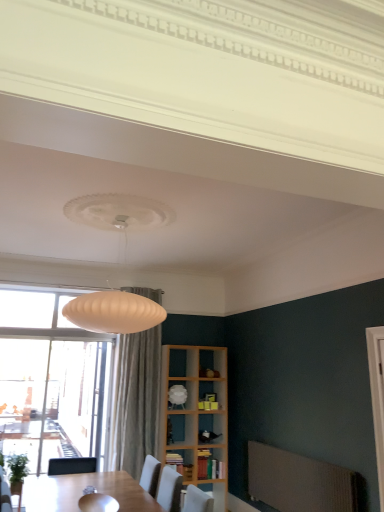
What is the approximate width of wooden bookshelf at center?

The width of wooden bookshelf at center is 13.57 inches.

The height and width of the screenshot is (512, 384). What do you see at coordinates (181, 463) in the screenshot?
I see `wooden bookshelf at lower center, positioned as the first shelf in bottom-to-top order` at bounding box center [181, 463].

What do you see at coordinates (377, 397) in the screenshot?
I see `white glossy screen door at right` at bounding box center [377, 397].

Find the location of `wooden bookshelf at center`. wooden bookshelf at center is located at coordinates (210, 466).

From a real-world perspective, is white glossy shelf at center, the 2th shelf in the bottom-to-top sequence, physically located above or below white glossy screen door at right?

Clearly, from a real-world perspective, white glossy shelf at center, the 2th shelf in the bottom-to-top sequence, is below white glossy screen door at right.

Considering the relative sizes of white glossy shelf at center, the 2th shelf in the bottom-to-top sequence, and white glossy screen door at right in the image provided, is white glossy shelf at center, the 2th shelf in the bottom-to-top sequence, smaller than white glossy screen door at right?

Actually, white glossy shelf at center, the 2th shelf in the bottom-to-top sequence, might be larger than white glossy screen door at right.

Looking at this image, from the image's perspective, is white glossy shelf at center, the first shelf when ordered from top to bottom, located beneath white glossy screen door at right?

Correct, white glossy shelf at center, the first shelf when ordered from top to bottom, appears lower than white glossy screen door at right in the image.

What's the angular difference between white glossy shelf at center, the 2th shelf in the bottom-to-top sequence, and white glossy screen door at right's facing directions?

There is a 88.6-degree angle between the facing directions of white glossy shelf at center, the 2th shelf in the bottom-to-top sequence, and white glossy screen door at right.

From a real-world perspective, between wooden bookshelf at lower center, the 2th shelf in the top-to-bottom sequence, and white glossy shelf at center, the 2th shelf in the bottom-to-top sequence, who is vertically higher?

white glossy shelf at center, the 2th shelf in the bottom-to-top sequence, is physically above.

Is wooden bookshelf at lower center, the 2th shelf in the top-to-bottom sequence, located outside white glossy shelf at center, the first shelf when ordered from top to bottom?

Yes, wooden bookshelf at lower center, the 2th shelf in the top-to-bottom sequence, is located beyond the bounds of white glossy shelf at center, the first shelf when ordered from top to bottom.

Is wooden bookshelf at lower center, the 2th shelf in the top-to-bottom sequence, not close to white glossy shelf at center, the first shelf when ordered from top to bottom?

No, wooden bookshelf at lower center, the 2th shelf in the top-to-bottom sequence, is in close proximity to white glossy shelf at center, the first shelf when ordered from top to bottom.

Is white glossy shelf at center, the first shelf when ordered from top to bottom, directly adjacent to wooden bookshelf at lower center, the 2th shelf in the top-to-bottom sequence?

white glossy shelf at center, the first shelf when ordered from top to bottom, is not next to wooden bookshelf at lower center, the 2th shelf in the top-to-bottom sequence, and they're not touching.

Is point (184, 397) positioned after point (180, 462)?

Yes, point (184, 397) is farther from viewer.

Is white glossy shelf at center, the first shelf when ordered from top to bottom, to the right of wooden bookshelf at lower center, the 2th shelf in the top-to-bottom sequence, from the viewer's perspective?

In fact, white glossy shelf at center, the first shelf when ordered from top to bottom, is to the left of wooden bookshelf at lower center, the 2th shelf in the top-to-bottom sequence.

What's the angular difference between white glossy shelf at center, the first shelf when ordered from top to bottom, and wooden bookshelf at center's facing directions?

The facing directions of white glossy shelf at center, the first shelf when ordered from top to bottom, and wooden bookshelf at center are 0.000589 degrees apart.

Is white glossy shelf at center, the first shelf when ordered from top to bottom, positioned behind wooden bookshelf at center?

Yes, white glossy shelf at center, the first shelf when ordered from top to bottom, is further from the viewer.

Is white glossy shelf at center, the first shelf when ordered from top to bottom, positioned with its back to wooden bookshelf at center?

white glossy shelf at center, the first shelf when ordered from top to bottom, does not have its back to wooden bookshelf at center.

I want to click on cabinet below the white glossy shelf at center, the 2th shelf in the bottom-to-top sequence (from the image's perspective), so click(x=210, y=466).

Is white glossy screen door at right at the back of wooden bookshelf at center?

No.

From a real-world perspective, is wooden bookshelf at center physically below white glossy screen door at right?

Yes.

Consider the image. Which of these two, wooden bookshelf at center or white glossy screen door at right, is wider?

With larger width is wooden bookshelf at center.

In the image, is wooden bookshelf at center positioned in front of or behind white glossy screen door at right?

wooden bookshelf at center is behind white glossy screen door at right.

From the image's perspective, between white glossy screen door at right and white glossy shelf at center, the first shelf when ordered from top to bottom, which one is located above?

white glossy screen door at right appears higher in the image.

Which of these two, white glossy screen door at right or white glossy shelf at center, the first shelf when ordered from top to bottom, is smaller?

Smaller between the two is white glossy screen door at right.

Which shelf is the 2nd one when counting from the left side of the white glossy screen door at right? Please provide its 2D coordinates.

[(180, 395)]

Is point (380, 345) farther from camera compared to point (174, 408)?

That is False.

Based on the photo, considering the relative positions of wooden bookshelf at lower center, positioned as the first shelf in bottom-to-top order, and white glossy screen door at right in the image provided, is wooden bookshelf at lower center, positioned as the first shelf in bottom-to-top order, to the left of white glossy screen door at right from the viewer's perspective?

Yes, wooden bookshelf at lower center, positioned as the first shelf in bottom-to-top order, is to the left of white glossy screen door at right.

Who is shorter, wooden bookshelf at lower center, positioned as the first shelf in bottom-to-top order, or white glossy screen door at right?

With less height is wooden bookshelf at lower center, positioned as the first shelf in bottom-to-top order.

The height and width of the screenshot is (512, 384). In order to click on the 1st shelf behind the white glossy screen door at right in this screenshot , I will do `click(181, 463)`.

From the picture: Could you tell me if wooden bookshelf at lower center, positioned as the first shelf in bottom-to-top order, is turned towards white glossy screen door at right?

Yes, wooden bookshelf at lower center, positioned as the first shelf in bottom-to-top order, is facing white glossy screen door at right.

Where is `shelf that is the 1st object located below the white glossy screen door at right (from the image's perspective)`? Image resolution: width=384 pixels, height=512 pixels. shelf that is the 1st object located below the white glossy screen door at right (from the image's perspective) is located at coordinates (180, 395).

This screenshot has height=512, width=384. Identify the location of shelf on the left of wooden bookshelf at lower center, the 2th shelf in the top-to-bottom sequence. (180, 395).

Based on their spatial positions, is white glossy screen door at right or white glossy shelf at center, the first shelf when ordered from top to bottom, further from wooden bookshelf at lower center, the 2th shelf in the top-to-bottom sequence?

The object further to wooden bookshelf at lower center, the 2th shelf in the top-to-bottom sequence, is white glossy screen door at right.

Based on their spatial positions, is white glossy shelf at center, the 2th shelf in the bottom-to-top sequence, or wooden bookshelf at center further from wooden bookshelf at lower center, positioned as the first shelf in bottom-to-top order?

The object further to wooden bookshelf at lower center, positioned as the first shelf in bottom-to-top order, is white glossy shelf at center, the 2th shelf in the bottom-to-top sequence.

Based on the photo, from the image, which object appears to be nearer to white glossy shelf at center, the first shelf when ordered from top to bottom, white glossy screen door at right or wooden bookshelf at center?

wooden bookshelf at center is closer to white glossy shelf at center, the first shelf when ordered from top to bottom.

Which object lies nearer to the anchor point wooden bookshelf at center, white glossy shelf at center, the first shelf when ordered from top to bottom, or wooden bookshelf at lower center, positioned as the first shelf in bottom-to-top order?

The object closer to wooden bookshelf at center is wooden bookshelf at lower center, positioned as the first shelf in bottom-to-top order.

Based on their spatial positions, is white glossy shelf at center, the first shelf when ordered from top to bottom, or white glossy screen door at right further from wooden bookshelf at lower center, positioned as the first shelf in bottom-to-top order?

white glossy screen door at right.

Which object lies nearer to the anchor point white glossy screen door at right, wooden bookshelf at center or white glossy shelf at center, the 2th shelf in the bottom-to-top sequence?

wooden bookshelf at center.

In the scene shown: Looking at the image, which one is located closer to wooden bookshelf at center, white glossy screen door at right or wooden bookshelf at lower center, the 2th shelf in the top-to-bottom sequence?

The object closer to wooden bookshelf at center is wooden bookshelf at lower center, the 2th shelf in the top-to-bottom sequence.

Based on their spatial positions, is wooden bookshelf at lower center, positioned as the first shelf in bottom-to-top order, or white glossy shelf at center, the first shelf when ordered from top to bottom, further from white glossy screen door at right?

white glossy shelf at center, the first shelf when ordered from top to bottom, lies further to white glossy screen door at right than the other object.

This screenshot has height=512, width=384. In order to click on shelf between white glossy screen door at right and wooden bookshelf at center from front to back in this screenshot , I will do 181,463.

What are the coordinates of `cabinet located between white glossy screen door at right and white glossy shelf at center, the first shelf when ordered from top to bottom, in the depth direction` in the screenshot? It's located at (210, 466).

Image resolution: width=384 pixels, height=512 pixels. Find the location of `shelf between white glossy screen door at right and white glossy shelf at center, the first shelf when ordered from top to bottom, from front to back`. shelf between white glossy screen door at right and white glossy shelf at center, the first shelf when ordered from top to bottom, from front to back is located at coordinates (181, 463).

Where is `shelf between white glossy shelf at center, the 2th shelf in the bottom-to-top sequence, and wooden bookshelf at center in the up-down direction`? The height and width of the screenshot is (512, 384). shelf between white glossy shelf at center, the 2th shelf in the bottom-to-top sequence, and wooden bookshelf at center in the up-down direction is located at coordinates (x=181, y=463).